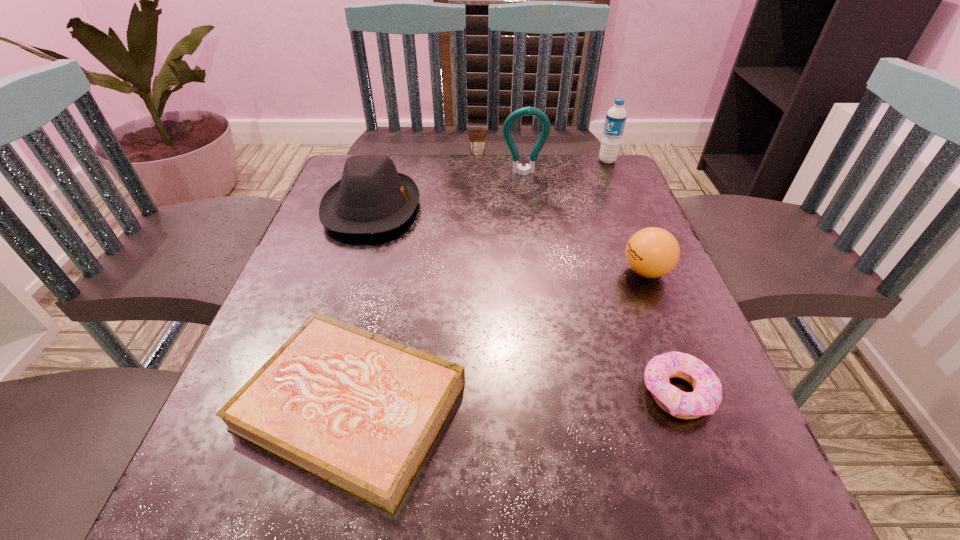
Identify the location of blank space located 0.340m on the label of the farthest object. Image resolution: width=960 pixels, height=540 pixels. (477, 160).

Where is `free spot located 0.160m on the front-facing side of the fourth nearest object`? Image resolution: width=960 pixels, height=540 pixels. free spot located 0.160m on the front-facing side of the fourth nearest object is located at coordinates (487, 208).

This screenshot has height=540, width=960. What are the coordinates of `blank space located 0.280m on the side with brand of the fourth farthest object` in the screenshot? It's located at (484, 272).

Where is `free space located on the side with brand of the fourth farthest object`? This screenshot has height=540, width=960. free space located on the side with brand of the fourth farthest object is located at coordinates (468, 272).

Where is `blank space located on the side with brand of the fourth farthest object`? This screenshot has height=540, width=960. blank space located on the side with brand of the fourth farthest object is located at coordinates (596, 272).

The image size is (960, 540). Find the location of `vacant position located on the right of the hardback book`. vacant position located on the right of the hardback book is located at coordinates (563, 406).

Locate an element on the screen. Image resolution: width=960 pixels, height=540 pixels. free space located 0.280m on the back of the doughnut is located at coordinates (626, 254).

This screenshot has width=960, height=540. In order to click on bottle opener located in the far edge section of the desktop in this screenshot , I will do `click(517, 168)`.

This screenshot has width=960, height=540. In order to click on water bottle present at the far edge in this screenshot , I will do `click(616, 116)`.

At what (x,y) coordinates should I click in order to perform the action: click on fedora located at the far edge. Please return your answer as a coordinate pair (x, y). Looking at the image, I should click on (372, 197).